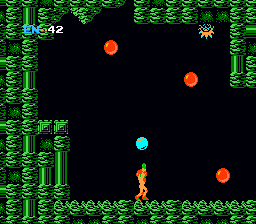
Where is `horizontal pipe`? This screenshot has width=256, height=224. horizontal pipe is located at coordinates (3, 192), (3, 128), (3, 64), (250, 34).